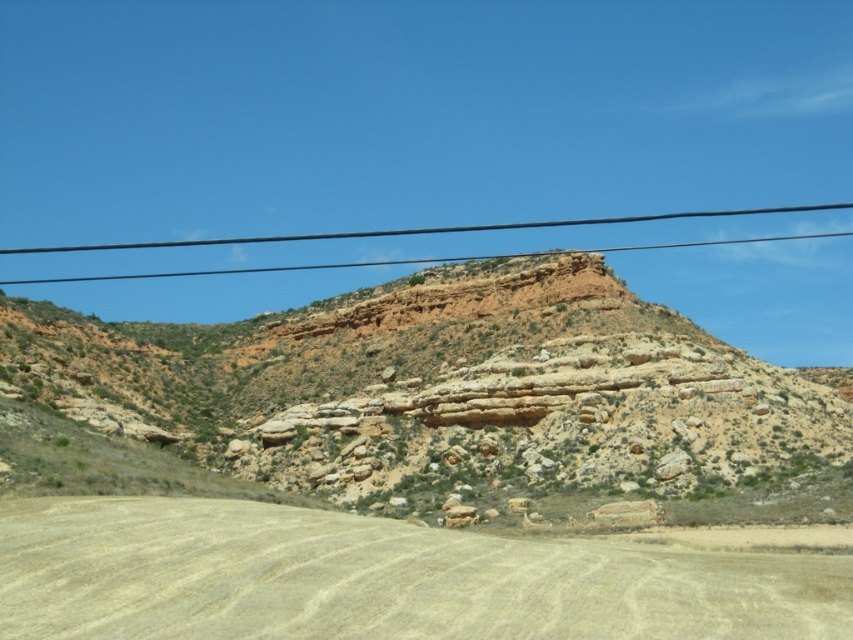
Question: Is light brown dirt track at lower center below black wire at upper center?

Choices:
 (A) yes
 (B) no

Answer: (A)

Question: Can you confirm if rustic rock formation at center is bigger than black wire at upper center?

Choices:
 (A) no
 (B) yes

Answer: (A)

Question: Which of the following is the farthest from the observer?

Choices:
 (A) rustic rock formation at center
 (B) light brown dirt track at lower center

Answer: (A)

Question: Which point is farther from the camera taking this photo?

Choices:
 (A) [346, 368]
 (B) [138, 561]
 (C) [309, 236]

Answer: (C)

Question: Where is rustic rock formation at center located in relation to black wire at upper center in the image?

Choices:
 (A) below
 (B) above

Answer: (A)

Question: Among these points, which one is nearest to the camera?

Choices:
 (A) (811, 209)
 (B) (44, 541)

Answer: (B)